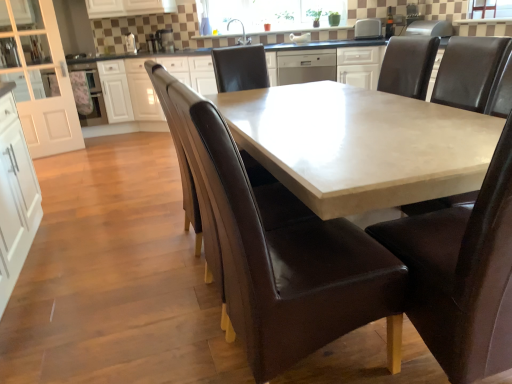
Identify the location of blank space to the left of brown leather chair at center, which appears as the 3th chair when viewed from the right. The image size is (512, 384). (162, 346).